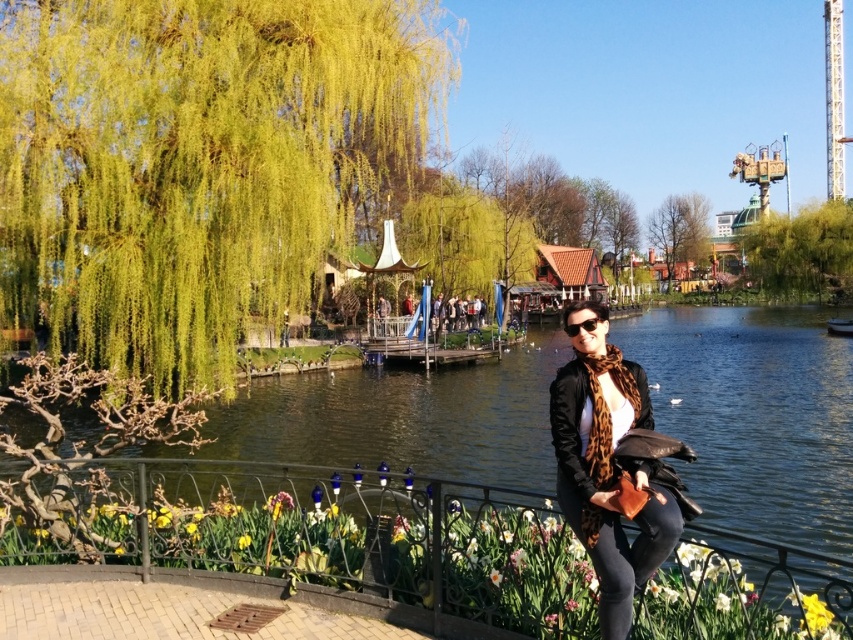
You are a photographer planning to capture a wide shot of the green leafy willow at upper left and the yellow matte flower at center. Given that your camera has a maximum focus range of 30 meters, will you be able to capture both subjects in focus simultaneously?

The green leafy willow at upper left is 30.17 meters from the yellow matte flower at center, which exceeds the camera maximum focus range of 30 meters. Therefore, you cannot capture both subjects in focus simultaneously.

You are a photographer trying to capture the green leafy willow at upper left and the yellow matte flower at center in a single shot. Which object will occupy more space in the photo?

The green leafy willow at upper left will occupy more space in the photo because its width is larger than the yellow matte flower at center.

You are a photographer trying to capture a shot of both the green leafy willow at upper left and the yellow matte flower at center. Which object should you focus on first to ensure it appears sharp in the photo?

You should focus on the green leafy willow at upper left first because it is closer to you than the yellow matte flower at center, so it will be in focus first.